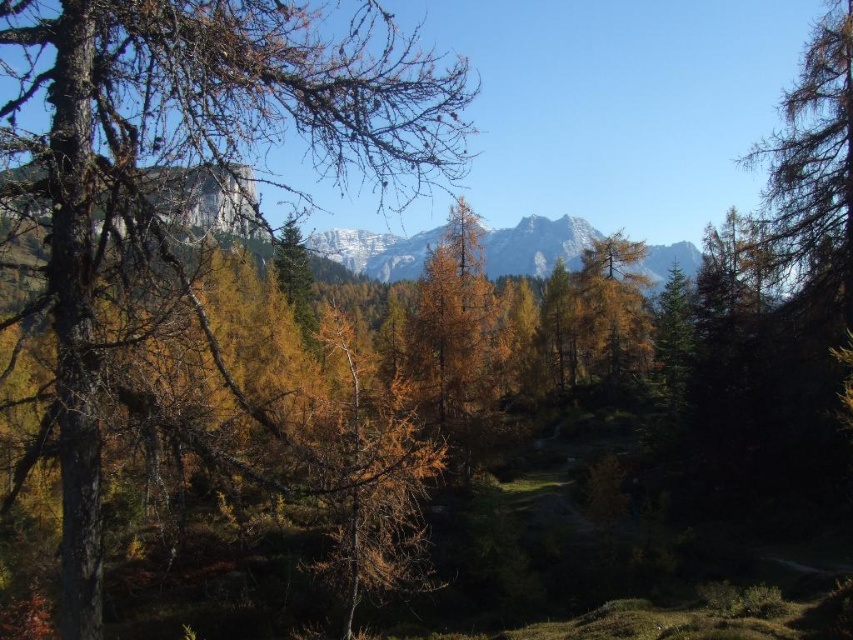
Who is shorter, brown rough bark tree at left or yellow matte tree at center?

yellow matte tree at center

Does brown rough bark tree at left come in front of yellow matte tree at center?

That is True.

Image resolution: width=853 pixels, height=640 pixels. What are the coordinates of `brown rough bark tree at left` in the screenshot? It's located at (187, 161).